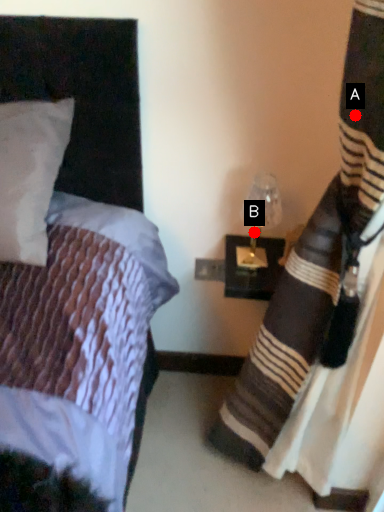
Question: Two points are circled on the image, labeled by A and B beside each circle. Which point appears closest to the camera in this image?

Choices:
 (A) A is closer
 (B) B is closer

Answer: (A)